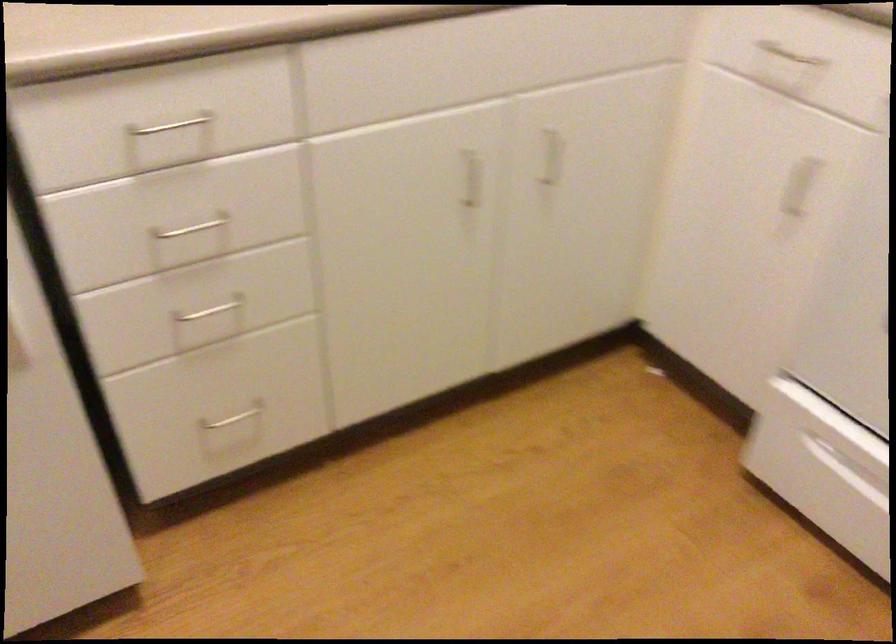
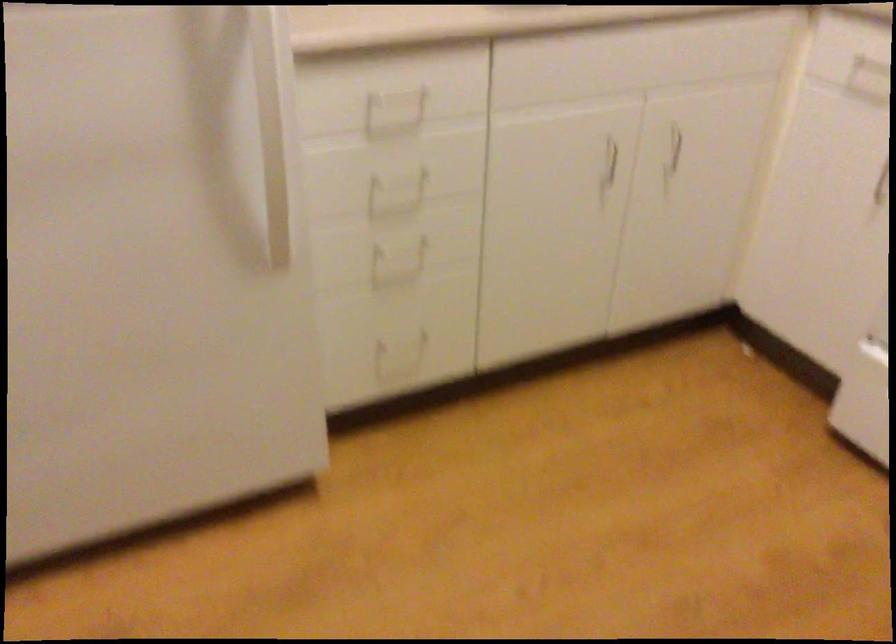
Locate, in the second image, the point that corresponds to point 475,184 in the first image.

(609, 161)